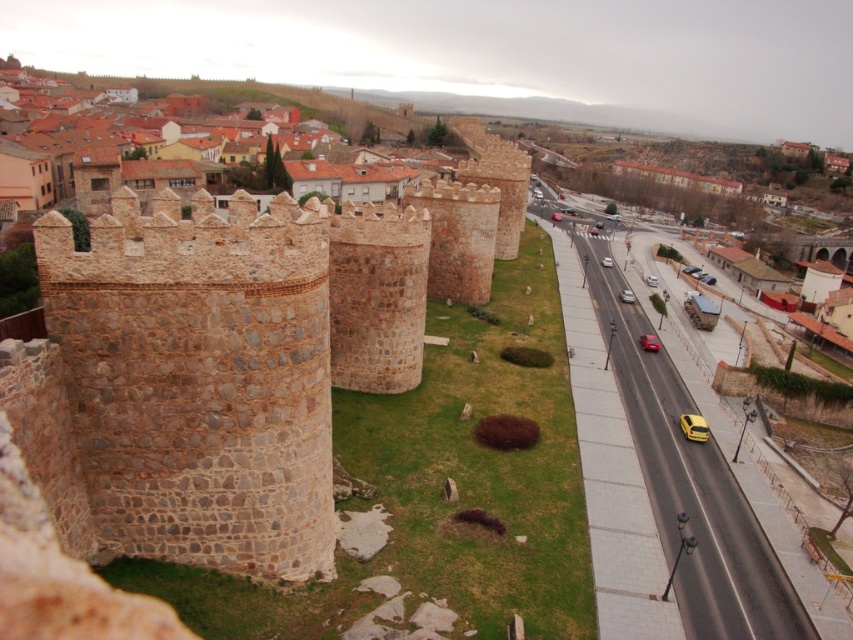
Question: Is brown stone castle at center in front of shiny red car at center?

Choices:
 (A) no
 (B) yes

Answer: (B)

Question: Among these points, which one is farthest from the camera?

Choices:
 (A) (219, 120)
 (B) (625, 296)
 (C) (657, 340)

Answer: (A)

Question: Is brown stone wall at upper left closer to camera compared to silver metallic car at center?

Choices:
 (A) yes
 (B) no

Answer: (B)

Question: Estimate the real-world distances between objects in this image. Which object is closer to the brown stone wall at upper left?

Choices:
 (A) silver metallic car at center
 (B) shiny red car at center
 (C) brown stone castle at center
 (D) silver metallic sedan at center

Answer: (C)

Question: Can you confirm if brown stone castle at center is positioned above brown stone wall at upper left?

Choices:
 (A) yes
 (B) no

Answer: (B)

Question: Which of these objects is positioned closest to the brown stone castle at center?

Choices:
 (A) brown stone wall at upper left
 (B) shiny red car at center
 (C) silver metallic car at center
 (D) silver metallic sedan at center

Answer: (D)